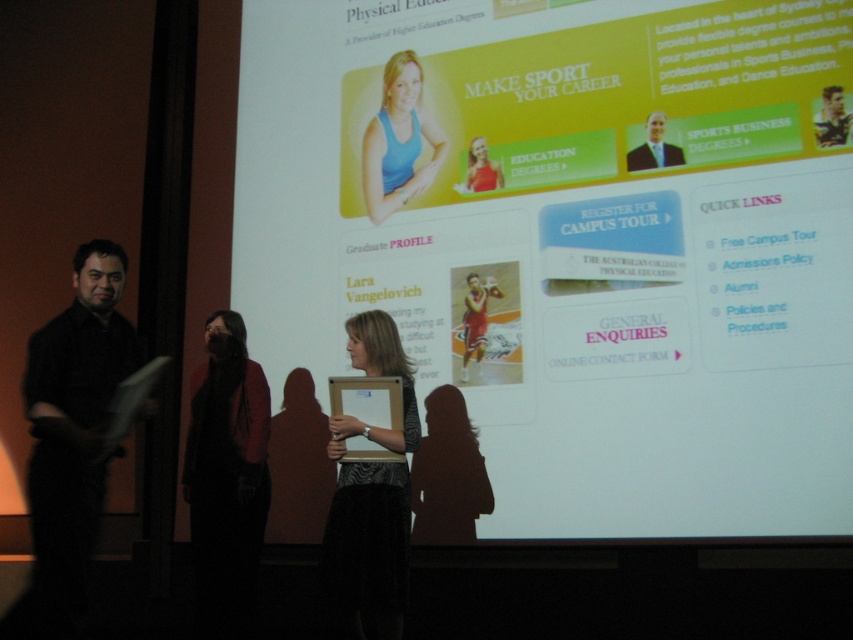
Does black matte shirt at left appear over matte red tank top at upper center?

No, black matte shirt at left is not above matte red tank top at upper center.

Looking at this image, can you confirm if black matte shirt at left is positioned to the left of matte red tank top at upper center?

Correct, you'll find black matte shirt at left to the left of matte red tank top at upper center.

Find the location of a particular element. black matte shirt at left is located at coordinates (71, 438).

Who is more distant from viewer, (76, 493) or (827, 141)?

The point (827, 141) is behind.

Who is positioned more to the left, black matte shirt at left or metallic silver helmet at upper right?

black matte shirt at left

Measure the distance between point [120,323] and camera.

Point [120,323] is 3.39 meters away from camera.

Locate an element on the screen. black matte shirt at left is located at coordinates (71, 438).

Is dark red sweater at center wider than metallic silver helmet at upper right?

Correct, the width of dark red sweater at center exceeds that of metallic silver helmet at upper right.

Who is higher up, dark red sweater at center or metallic silver helmet at upper right?

metallic silver helmet at upper right is above.

Locate an element on the screen. The height and width of the screenshot is (640, 853). dark red sweater at center is located at coordinates (225, 481).